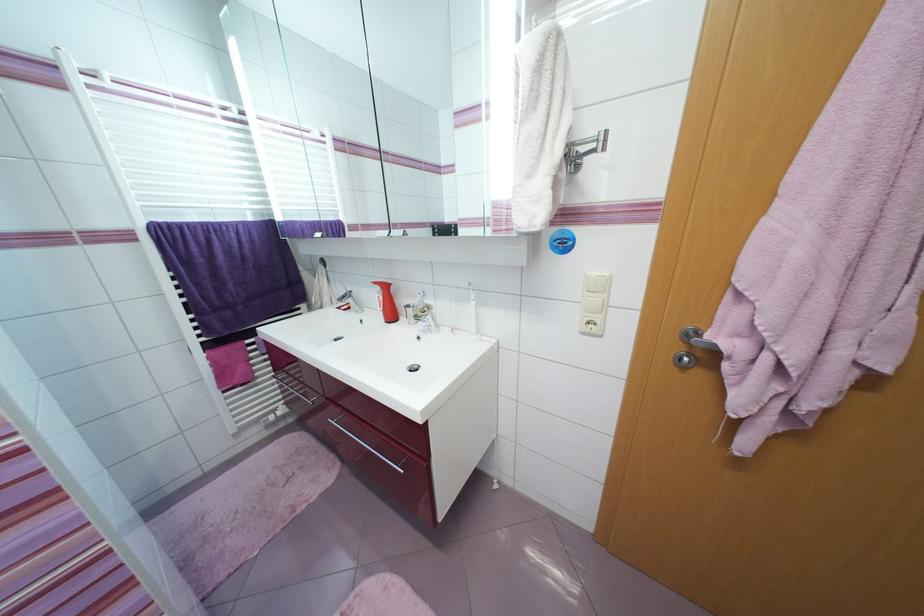
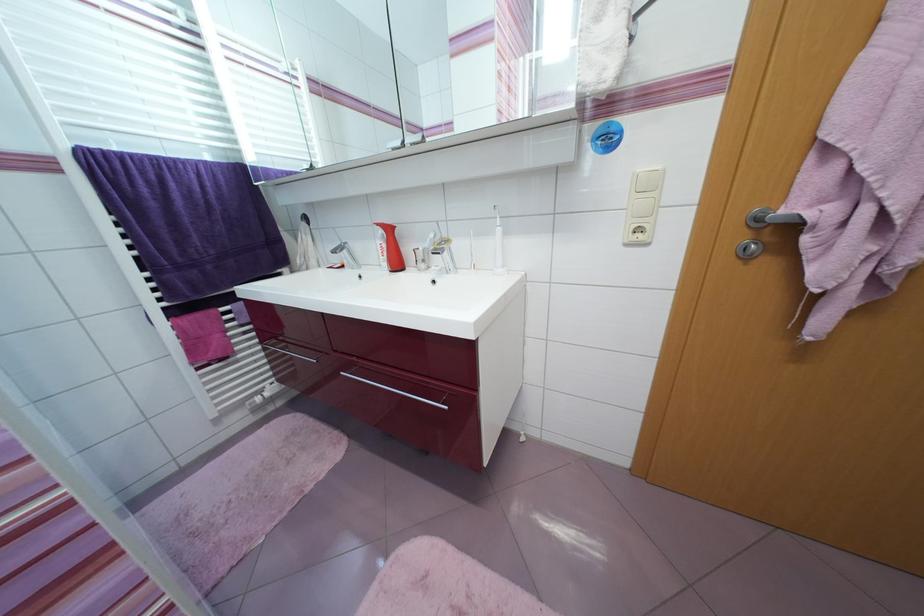
Which direction would the cameraman need to move to produce the second image?

The cameraman walked toward left, forward.